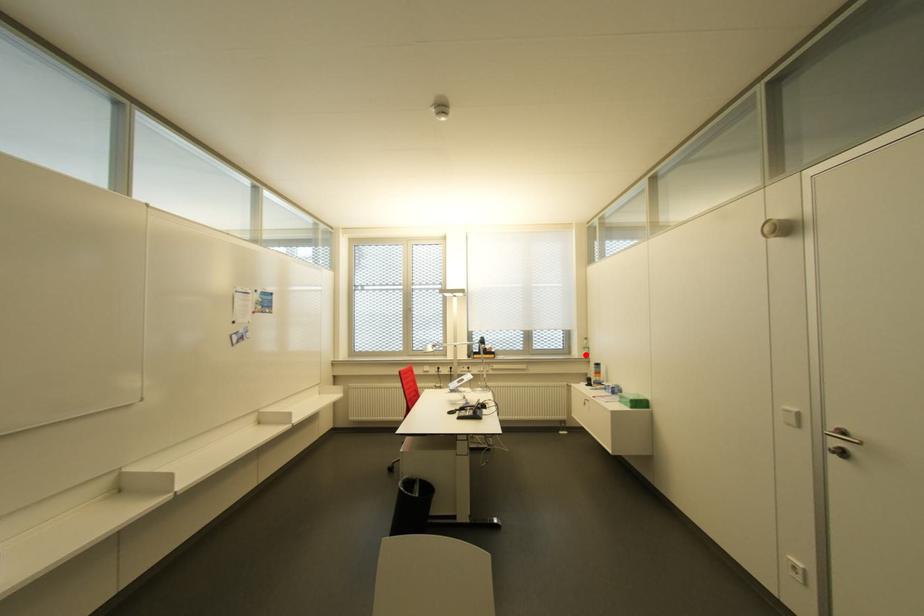
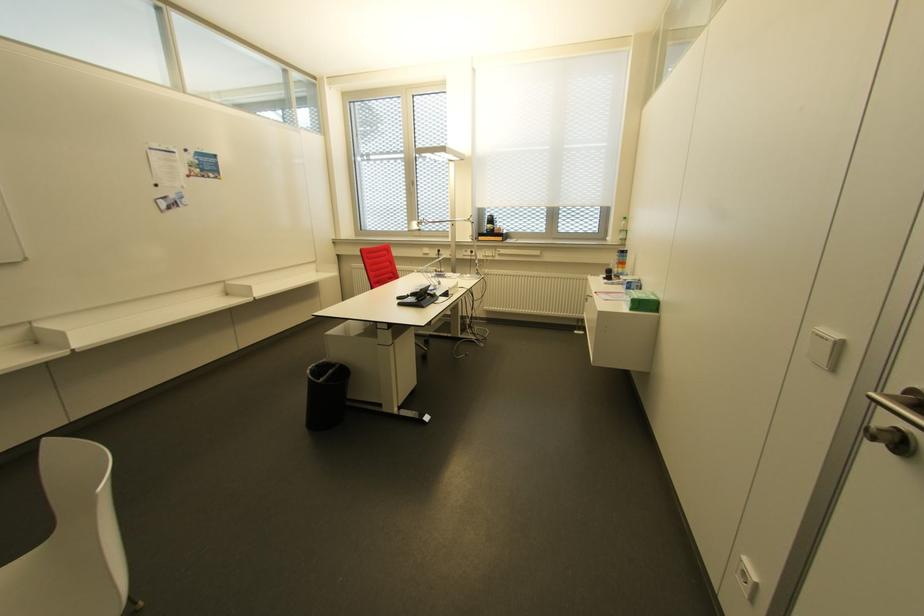
In the second image, find the point that corresponds to the highlighted location in the first image.

(623, 240)